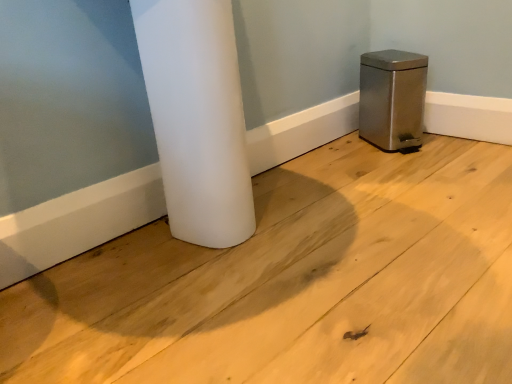
The width and height of the screenshot is (512, 384). What are the coordinates of `free spot to the right of brushed metal trash can at right` in the screenshot? It's located at (454, 140).